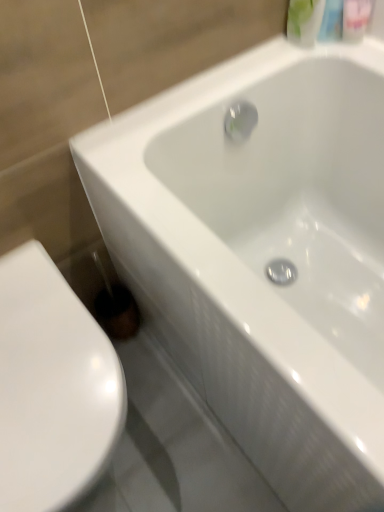
Question: Is white glossy toilet at lower left behind green matte bottle at upper right, the second mouthwash when ordered from right to left?

Choices:
 (A) no
 (B) yes

Answer: (A)

Question: Considering the relative sizes of white glossy toilet at lower left and green matte bottle at upper right, the second mouthwash when ordered from right to left, in the image provided, is white glossy toilet at lower left smaller than green matte bottle at upper right, the second mouthwash when ordered from right to left,?

Choices:
 (A) yes
 (B) no

Answer: (B)

Question: Is white glossy toilet at lower left shorter than green matte bottle at upper right, the second mouthwash when ordered from right to left?

Choices:
 (A) no
 (B) yes

Answer: (A)

Question: Can you see white glossy toilet at lower left touching green matte bottle at upper right, the first mouthwash when ordered from left to right?

Choices:
 (A) yes
 (B) no

Answer: (B)

Question: Does white glossy toilet at lower left appear on the right side of green matte bottle at upper right, the second mouthwash when ordered from right to left?

Choices:
 (A) yes
 (B) no

Answer: (B)

Question: Is white glossy toilet at lower left located outside green matte bottle at upper right, the second mouthwash when ordered from right to left?

Choices:
 (A) no
 (B) yes

Answer: (B)

Question: Is green matte bottle at upper right, the first mouthwash when ordered from left to right, far from white glossy toilet at lower left?

Choices:
 (A) yes
 (B) no

Answer: (B)

Question: Is green matte bottle at upper right, the second mouthwash when ordered from right to left, aimed at white glossy toilet at lower left?

Choices:
 (A) no
 (B) yes

Answer: (B)

Question: From the image's perspective, is green matte bottle at upper right, the first mouthwash when ordered from left to right, beneath white glossy toilet at lower left?

Choices:
 (A) no
 (B) yes

Answer: (A)

Question: Is green matte bottle at upper right, the first mouthwash when ordered from left to right, bigger than white glossy toilet at lower left?

Choices:
 (A) no
 (B) yes

Answer: (A)

Question: Does green matte bottle at upper right, the second mouthwash when ordered from right to left, appear on the left side of white glossy toilet at lower left?

Choices:
 (A) no
 (B) yes

Answer: (A)

Question: Does green matte bottle at upper right, the first mouthwash when ordered from left to right, come behind white glossy toilet at lower left?

Choices:
 (A) no
 (B) yes

Answer: (B)

Question: Is white glossy toilet at lower left at the left side of translucent plastic mouthwash at upper right, marked as the 2th mouthwash in a left-to-right arrangement?

Choices:
 (A) yes
 (B) no

Answer: (A)